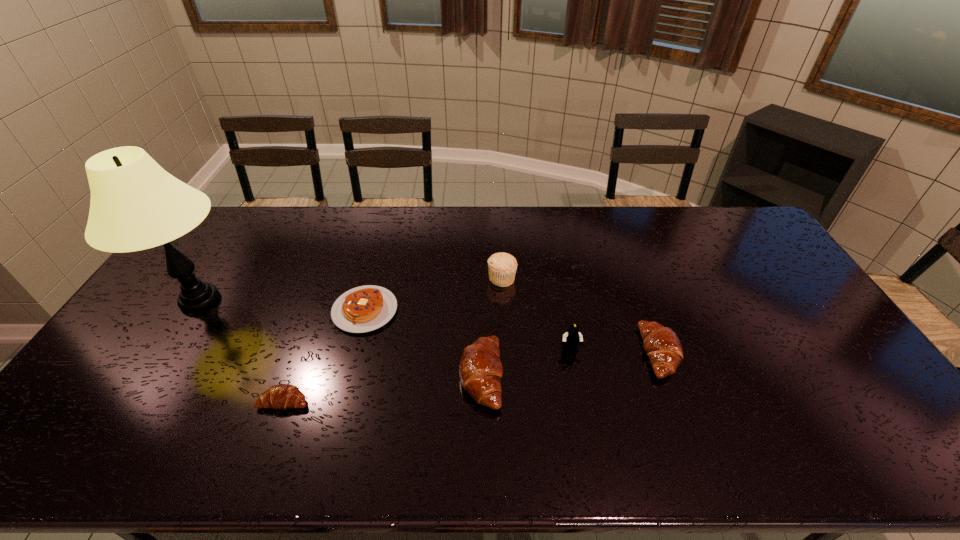
Where is `the leftmost crescent roll`? The image size is (960, 540). the leftmost crescent roll is located at coordinates (281, 396).

Where is `the second crescent roll from left to right`? the second crescent roll from left to right is located at coordinates (480, 369).

Locate an element on the screen. Image resolution: width=960 pixels, height=540 pixels. the rightmost object is located at coordinates (661, 344).

You are a GUI agent. You are given a task and a screenshot of the screen. Output one action in this format:
    pyautogui.click(x=<x>, y=<y>)
    Task: Click on the fifth tallest object
    This screenshot has height=540, width=960.
    Given the screenshot: What is the action you would take?
    pyautogui.click(x=661, y=344)

Find the location of `lamp`. lamp is located at coordinates (135, 205).

Where is `the tallest object`? This screenshot has height=540, width=960. the tallest object is located at coordinates (135, 205).

Identify the location of muffin. The image size is (960, 540). (502, 267).

This screenshot has width=960, height=540. What are the coordinates of `Lego` in the screenshot? It's located at 571,339.

At what (x,y) coordinates should I click in order to perform the action: click on pancake. Please return your answer as a coordinate pair (x, y). This screenshot has height=540, width=960. Looking at the image, I should click on (365, 308).

The height and width of the screenshot is (540, 960). Find the location of `vacant space situated 0.230m on the right of the shortest crescent roll`. vacant space situated 0.230m on the right of the shortest crescent roll is located at coordinates (400, 401).